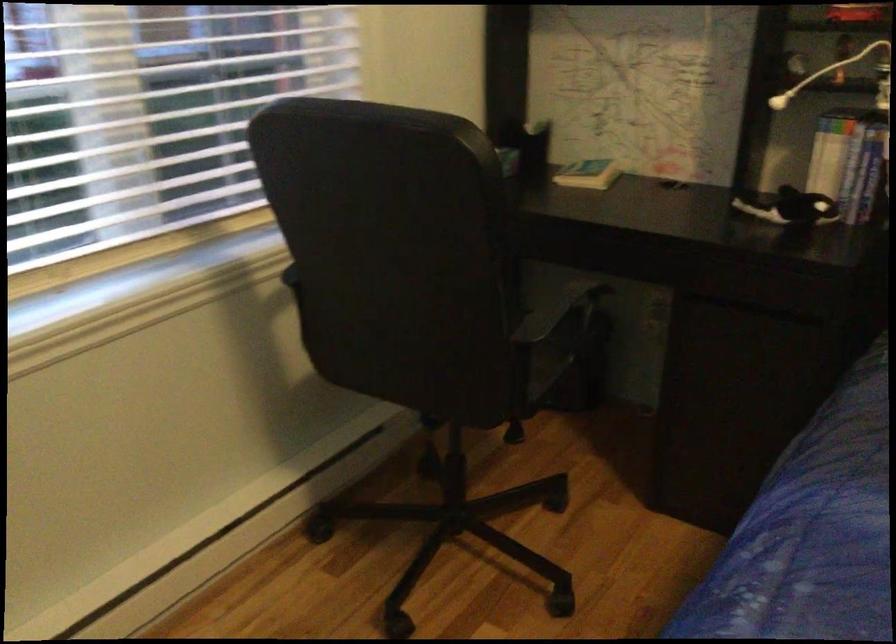
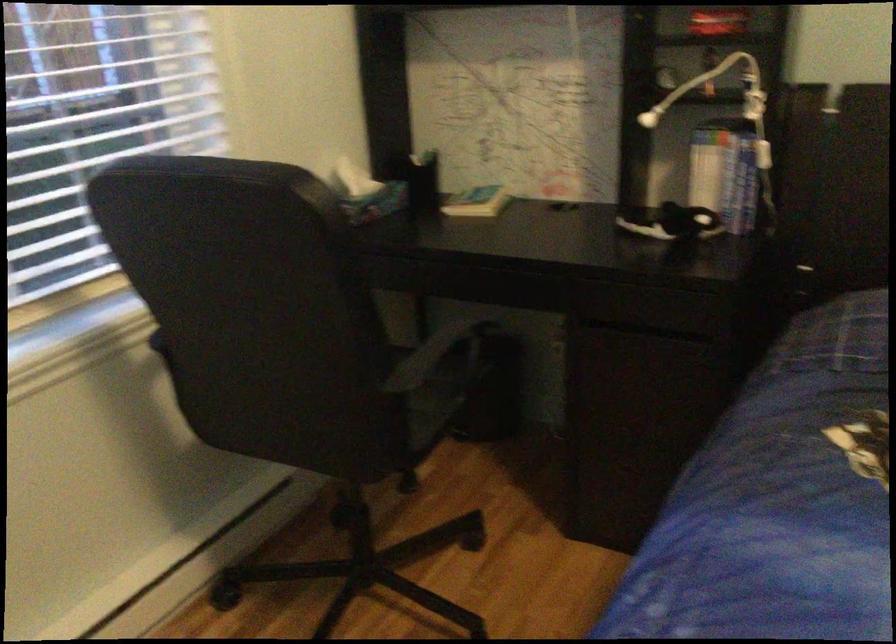
Question: The images are taken continuously from a first-person perspective. In which direction is your viewpoint rotating?

Choices:
 (A) Left
 (B) Right
 (C) Up
 (D) Down

Answer: (B)